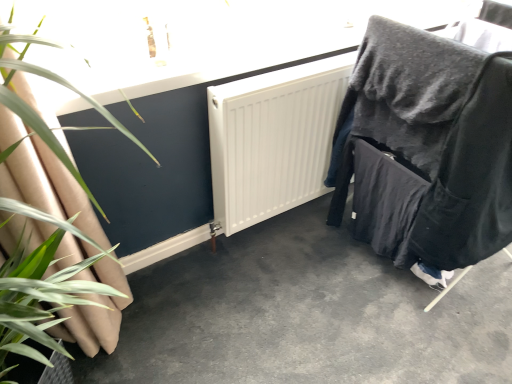
Describe the element at coordinates (49, 226) in the screenshot. I see `green leafy plant at left` at that location.

Describe the element at coordinates (305, 314) in the screenshot. Image resolution: width=512 pixels, height=384 pixels. I see `smooth concrete floor at center` at that location.

Identify the location of velvet black chair at right. The image size is (512, 384). (432, 144).

Considering the points (467, 269) and (466, 368), which point is behind, point (467, 269) or point (466, 368)?

Point (467, 269)

Which object is closer to the camera taking this photo, velvet black chair at right or smooth concrete floor at center?

Positioned in front is smooth concrete floor at center.

From a real-world perspective, is velvet black chair at right located beneath smooth concrete floor at center?

No, from a real-world perspective, velvet black chair at right is not below smooth concrete floor at center.

At what (x,y) coordinates should I click in order to perform the action: click on furniture on the right of the smooth concrete floor at center. Please return your answer as a coordinate pair (x, y). Image resolution: width=512 pixels, height=384 pixels. Looking at the image, I should click on (432, 144).

Consider the image. Who is bigger, smooth concrete floor at center or velvet black chair at right?

velvet black chair at right.

Is smooth concrete floor at center touching velvet black chair at right?

No, smooth concrete floor at center is not in contact with velvet black chair at right.

From the image's perspective, is smooth concrete floor at center over velvet black chair at right?

No, from the image's perspective, smooth concrete floor at center is not on top of velvet black chair at right.

Which is closer to the camera, [210,304] or [448,56]?

Clearly, point [210,304] is more distant from the camera than point [448,56].

At what (x,y) coordinates should I click in order to perform the action: click on houseplant in front of the velvet black chair at right. Please return your answer as a coordinate pair (x, y). Looking at the image, I should click on (49, 226).

Consider the image. How many degrees apart are the facing directions of green leafy plant at left and velvet black chair at right?

3.1 degrees separate the facing orientations of green leafy plant at left and velvet black chair at right.

Can you confirm if green leafy plant at left is positioned to the left of velvet black chair at right?

Correct, you'll find green leafy plant at left to the left of velvet black chair at right.

Who is shorter, green leafy plant at left or velvet black chair at right?

Standing shorter between the two is velvet black chair at right.

From their relative heights in the image, would you say green leafy plant at left is taller or shorter than smooth concrete floor at center?

green leafy plant at left is taller than smooth concrete floor at center.

Does point (18, 208) appear closer or farther from the camera than point (426, 376)?

Point (18, 208).

Identify the location of concrete located underneath the green leafy plant at left (from a real-world perspective). (305, 314).

In the image, is green leafy plant at left on the left side or the right side of smooth concrete floor at center?

From the image, it's evident that green leafy plant at left is to the left of smooth concrete floor at center.

Could you tell me if velvet black chair at right is facing green leafy plant at left?

No.

Consider the image. From the image's perspective, does velvet black chair at right appear lower than green leafy plant at left?

No.

Between velvet black chair at right and green leafy plant at left, which one has smaller size?

With smaller size is green leafy plant at left.

Visually, is velvet black chair at right positioned to the left or to the right of green leafy plant at left?

Based on their positions, velvet black chair at right is located to the right of green leafy plant at left.

Are smooth concrete floor at center and green leafy plant at left beside each other?

No.

From the image's perspective, is smooth concrete floor at center positioned above or below green leafy plant at left?

smooth concrete floor at center is below green leafy plant at left.

Is smooth concrete floor at center not inside green leafy plant at left?

Indeed, smooth concrete floor at center is completely outside green leafy plant at left.

From their relative heights in the image, would you say smooth concrete floor at center is taller or shorter than green leafy plant at left?

In the image, smooth concrete floor at center appears to be shorter than green leafy plant at left.

Identify the location of furniture on the right of smooth concrete floor at center. (432, 144).

Identify the location of concrete directly beneath the velvet black chair at right (from a real-world perspective). (305, 314).

From the image, which object appears to be nearer to green leafy plant at left, smooth concrete floor at center or velvet black chair at right?

smooth concrete floor at center.

Estimate the real-world distances between objects in this image. Which object is closer to smooth concrete floor at center, velvet black chair at right or green leafy plant at left?

velvet black chair at right.

Based on their spatial positions, is green leafy plant at left or velvet black chair at right closer to smooth concrete floor at center?

velvet black chair at right is closer to smooth concrete floor at center.

Based on their spatial positions, is smooth concrete floor at center or green leafy plant at left further from velvet black chair at right?

green leafy plant at left is further to velvet black chair at right.

Estimate the real-world distances between objects in this image. Which object is closer to green leafy plant at left, velvet black chair at right or smooth concrete floor at center?

Based on the image, smooth concrete floor at center appears to be nearer to green leafy plant at left.

From the image, which object appears to be nearer to velvet black chair at right, green leafy plant at left or smooth concrete floor at center?

Among the two, smooth concrete floor at center is located nearer to velvet black chair at right.

Locate an element on the screen. Image resolution: width=512 pixels, height=384 pixels. concrete between green leafy plant at left and velvet black chair at right in the horizontal direction is located at coordinates (305, 314).